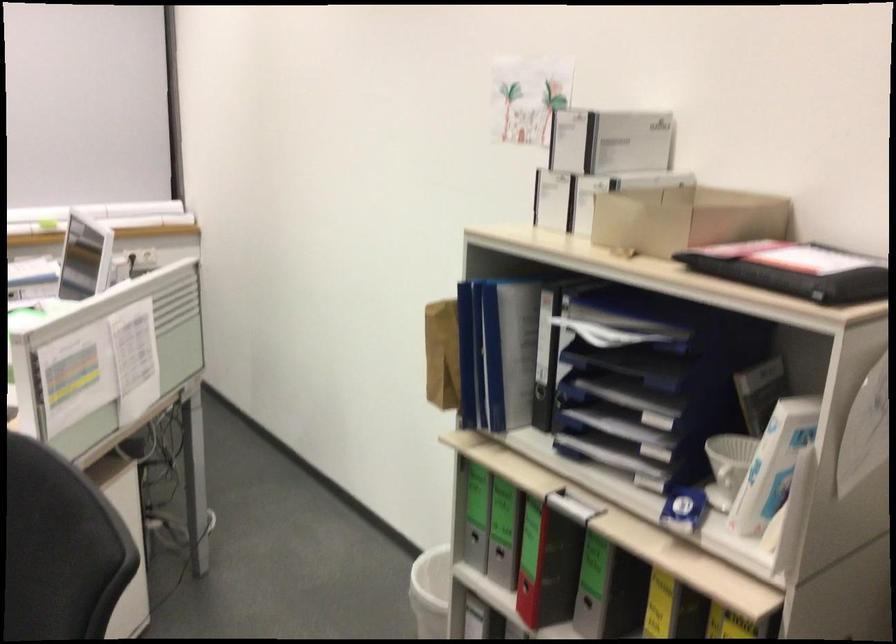
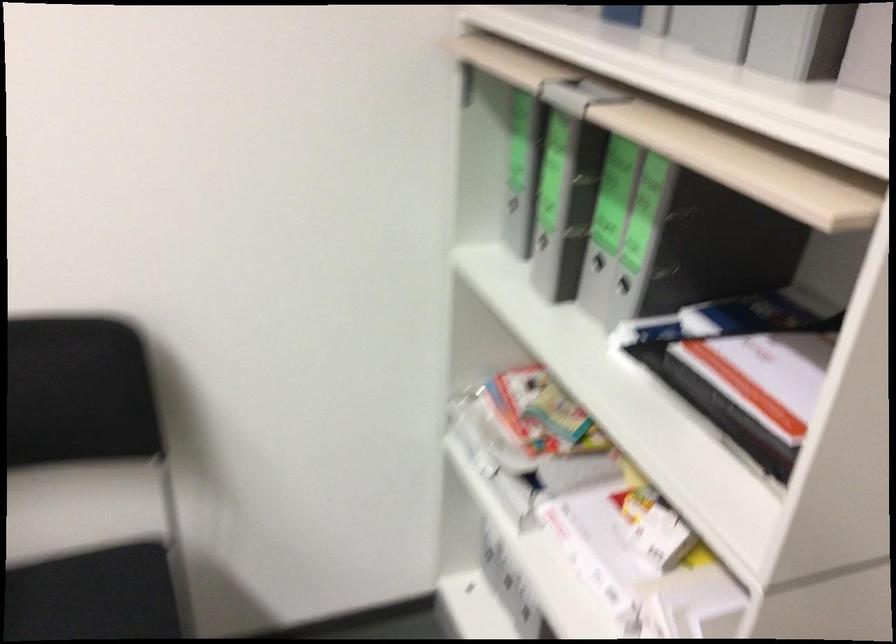
How did the camera likely rotate?

The camera rotated toward right-down.